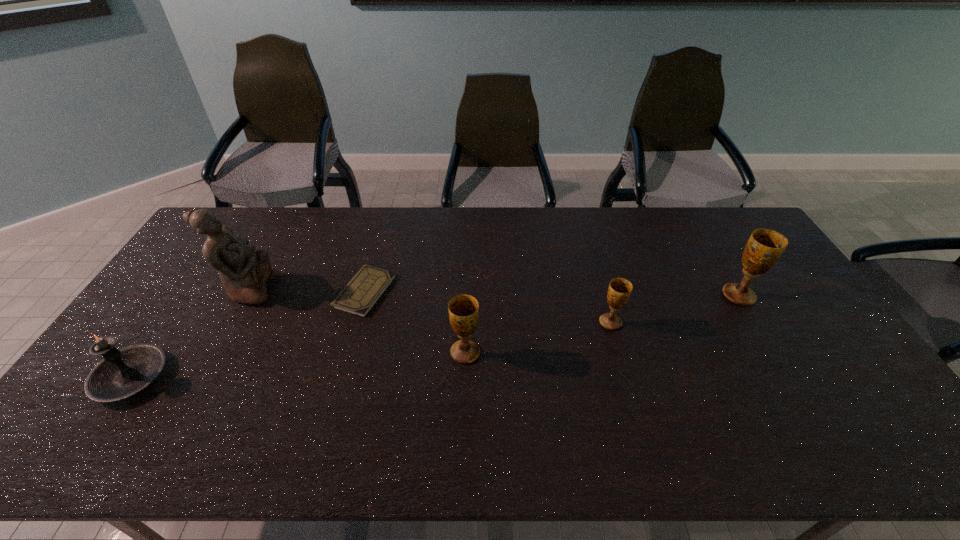
Find the location of a particular element. object situated at the near left corner is located at coordinates tap(122, 373).

In the image, there is a desktop. Where is `free space at the far edge`? free space at the far edge is located at coordinates (492, 244).

The height and width of the screenshot is (540, 960). Identify the location of vacant region at the near edge of the desktop. (561, 407).

The width and height of the screenshot is (960, 540). I want to click on free space at the left edge of the desktop, so click(201, 251).

This screenshot has height=540, width=960. I want to click on vacant area at the far right corner of the desktop, so click(x=742, y=233).

In the image, there is a desktop. Identify the location of vacant space at the near right corner. This screenshot has width=960, height=540. (863, 390).

This screenshot has width=960, height=540. What are the coordinates of `vacant point located between the second object from left to right and the second shortest chalice` in the screenshot? It's located at (357, 321).

I want to click on empty location between the second chalice from right to left and the fifth object from right to left, so click(x=430, y=306).

Where is `free spot between the third object from left to right and the candle`? free spot between the third object from left to right and the candle is located at coordinates (248, 334).

The height and width of the screenshot is (540, 960). What are the coordinates of `vacant region between the fifth object from left to right and the nearest chalice` in the screenshot? It's located at (538, 338).